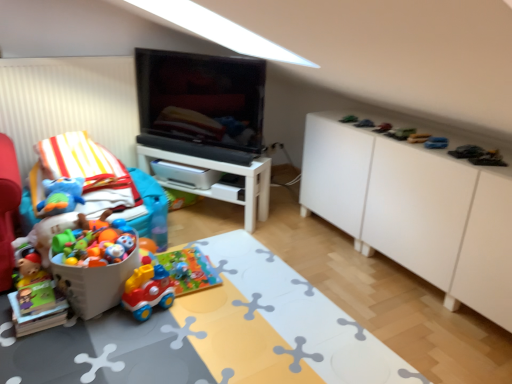
Question: From the image's perspective, is black glossy tv at center beneath white plastic bucket at lower left?

Choices:
 (A) yes
 (B) no

Answer: (B)

Question: Is black glossy tv at center not within white plastic bucket at lower left?

Choices:
 (A) yes
 (B) no

Answer: (A)

Question: Is black glossy tv at center oriented away from white plastic bucket at lower left?

Choices:
 (A) yes
 (B) no

Answer: (B)

Question: Can you confirm if black glossy tv at center is thinner than white plastic bucket at lower left?

Choices:
 (A) no
 (B) yes

Answer: (B)

Question: Are black glossy tv at center and white plastic bucket at lower left located far from each other?

Choices:
 (A) yes
 (B) no

Answer: (A)

Question: From their relative heights in the image, would you say metallic silver toy car at upper right, which is the sixth toy in right-to-left order, is taller or shorter than soft plush toy at left, the 1th toy from the left?

Choices:
 (A) tall
 (B) short

Answer: (B)

Question: Is point (386, 122) closer or farther from the camera than point (59, 180)?

Choices:
 (A) closer
 (B) farther

Answer: (B)

Question: Is metallic silver toy car at upper right, positioned as the sixth toy in left-to-right order, situated inside soft plush toy at left, the 11th toy in the right-to-left sequence, or outside?

Choices:
 (A) inside
 (B) outside

Answer: (B)

Question: In the image, is metallic silver toy car at upper right, which is the sixth toy in right-to-left order, positioned in front of or behind soft plush toy at left, the 11th toy in the right-to-left sequence?

Choices:
 (A) behind
 (B) front

Answer: (A)

Question: Is plastic toy car at upper right, arranged as the eleventh toy when viewed from the left, bigger or smaller than blue rubber toy at upper right, which ranks as the ninth toy in left-to-right order?

Choices:
 (A) small
 (B) big

Answer: (B)

Question: In the image, is plastic toy car at upper right, positioned as the first toy in right-to-left order, on the left side or the right side of blue rubber toy at upper right, which ranks as the ninth toy in left-to-right order?

Choices:
 (A) right
 (B) left

Answer: (A)

Question: Considering their positions, is plastic toy car at upper right, positioned as the first toy in right-to-left order, located in front of or behind blue rubber toy at upper right, which is the third toy from right to left?

Choices:
 (A) behind
 (B) front

Answer: (B)

Question: From their relative heights in the image, would you say plastic toy car at upper right, arranged as the eleventh toy when viewed from the left, is taller or shorter than blue rubber toy at upper right, which is the third toy from right to left?

Choices:
 (A) tall
 (B) short

Answer: (A)

Question: Considering the positions of blue rubber toy at upper right, which is the third toy from right to left, and green plastic toy car at upper right, which is counted as the 5th toy, starting from the right, in the image, is blue rubber toy at upper right, which is the third toy from right to left, taller or shorter than green plastic toy car at upper right, which is counted as the 5th toy, starting from the right,?

Choices:
 (A) short
 (B) tall

Answer: (A)

Question: Is blue rubber toy at upper right, which ranks as the ninth toy in left-to-right order, spatially inside green plastic toy car at upper right, the seventh toy in the left-to-right sequence, or outside of it?

Choices:
 (A) inside
 (B) outside

Answer: (B)